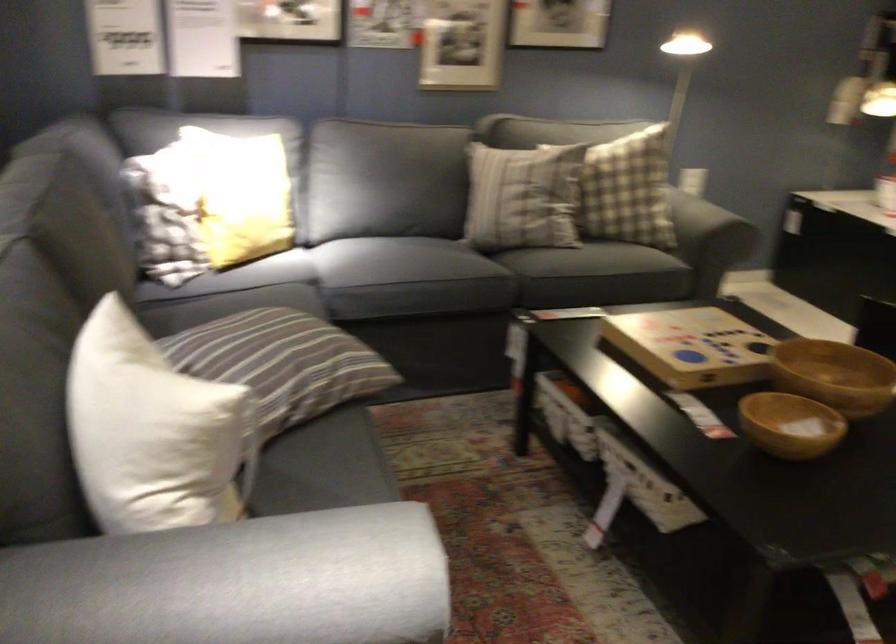
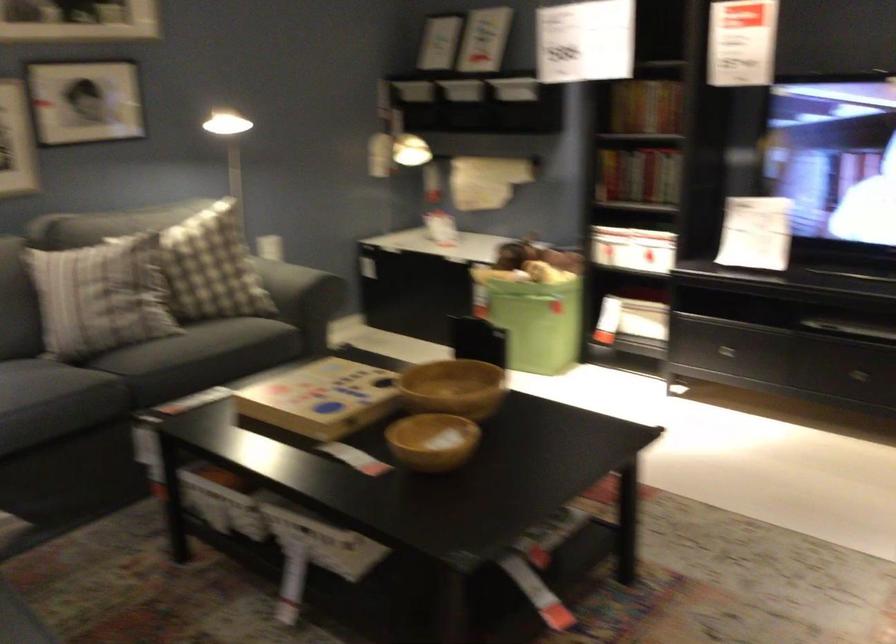
Find the pixel in the second image that matches (522,196) in the first image.

(99, 296)